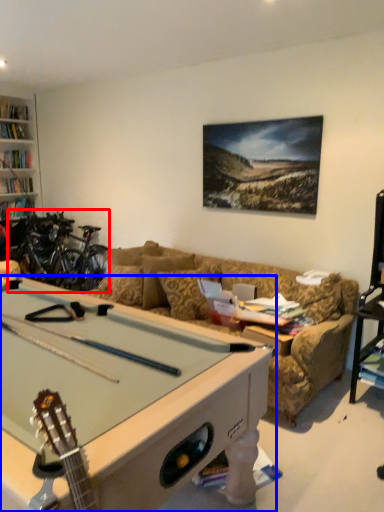
Question: Which object is closer to the camera taking this photo, bicycle (highlighted by a red box) or billiard table (highlighted by a blue box)?

Choices:
 (A) bicycle
 (B) billiard table

Answer: (B)